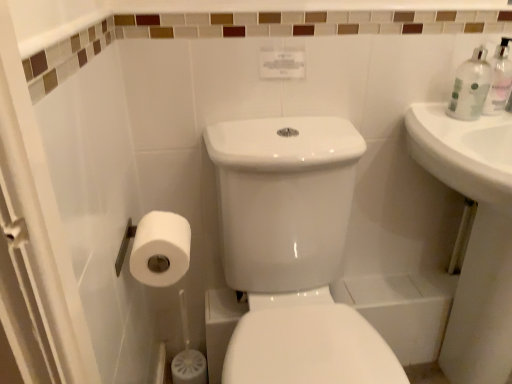
Locate an element on the screen. The image size is (512, 384). unoccupied area in front of clear plastic bottle at upper right is located at coordinates (459, 122).